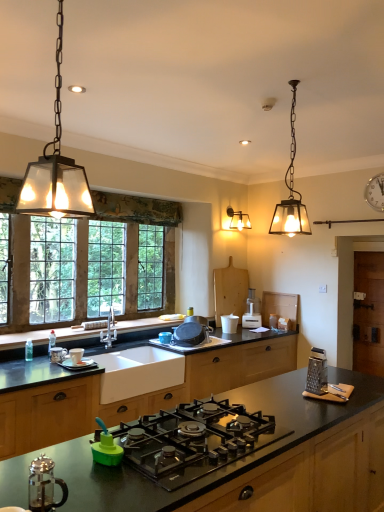
Question: Do you think metallic grater at right, which is counted as the second appliance, starting from the front, is within white ceramic cup at lower left, positioned as the sixth appliance in right-to-left order, or outside of it?

Choices:
 (A) inside
 (B) outside

Answer: (B)

Question: From a real-world perspective, is metallic grater at right, the first appliance positioned from the right, positioned above or below white ceramic cup at lower left, positioned as the sixth appliance in right-to-left order?

Choices:
 (A) below
 (B) above

Answer: (B)

Question: Estimate the real-world distances between objects in this image. Which object is closer to the black matte pot at center, the fourth appliance viewed from the front?

Choices:
 (A) metallic silver clock at upper right
 (B) brown wooden door at right, arranged as the 1th cabinetry when viewed from the right
 (C) metallic grater at right, the sixth appliance from the left
 (D) white ceramic sink at center
 (E) black glass gas stove at center

Answer: (D)

Question: Considering the real-world distances, which object is farthest from the white ceramic sink at center?

Choices:
 (A) shiny black countertop at center
 (B) matte black countertop at center, positioned as the first cabinetry in left-to-right order
 (C) brown wooden door at right, which is counted as the second cabinetry, starting from the left
 (D) white plastic food processor at center, positioned as the fifth appliance in left-to-right order
 (E) clear glass french press at lower left

Answer: (C)